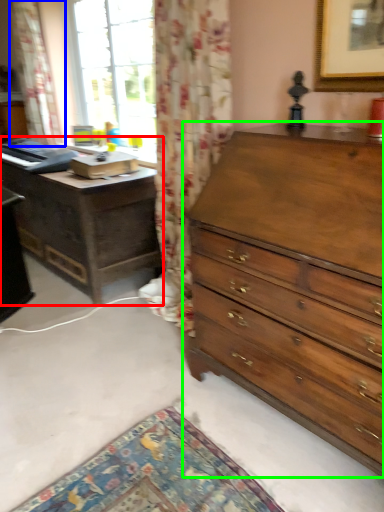
Question: Which object is positioned closest to nightstand (highlighted by a red box)? Select from curtain (highlighted by a blue box) and chest of drawers (highlighted by a green box).

Choices:
 (A) curtain
 (B) chest of drawers

Answer: (A)